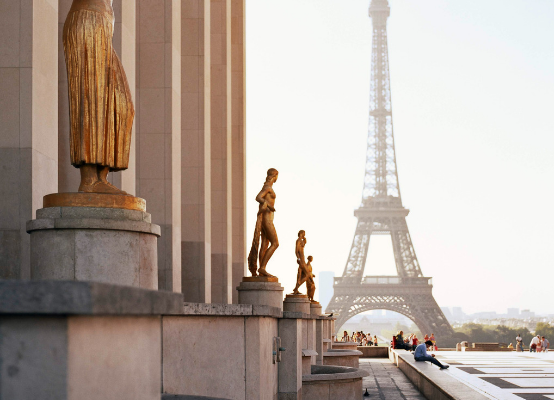
Where is `stands`? Image resolution: width=554 pixels, height=400 pixels. stands is located at coordinates (96, 248), (258, 292), (293, 305), (316, 306).